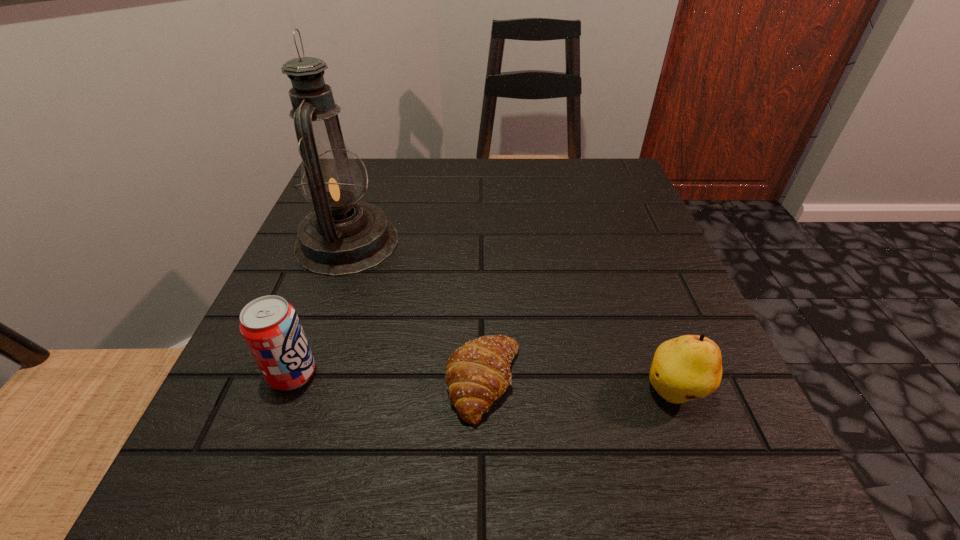
Find the location of a particular element. vacant space located on the left of the second object from right to left is located at coordinates coord(269,382).

I want to click on oil lamp that is at the left edge, so click(x=342, y=236).

Find the location of a particular element. The width and height of the screenshot is (960, 540). soda can positioned at the left edge is located at coordinates (270, 326).

Image resolution: width=960 pixels, height=540 pixels. I want to click on object that is at the right edge, so click(x=689, y=367).

The image size is (960, 540). In order to click on free space at the far edge of the desktop in this screenshot , I will do `click(412, 186)`.

In the image, there is a desktop. Identify the location of free space at the near edge. The height and width of the screenshot is (540, 960). (516, 467).

In the image, there is a desktop. Where is `vacant space at the left edge`? This screenshot has height=540, width=960. vacant space at the left edge is located at coordinates (366, 273).

Identify the location of blank space at the right edge of the desktop. (635, 219).

In the image, there is a desktop. In order to click on vacant space at the far right corner in this screenshot , I will do `click(597, 174)`.

At what (x,y) coordinates should I click in order to perform the action: click on free spot between the soda can and the oil lamp. Please return your answer as a coordinate pair (x, y). This screenshot has width=960, height=540. Looking at the image, I should click on (320, 308).